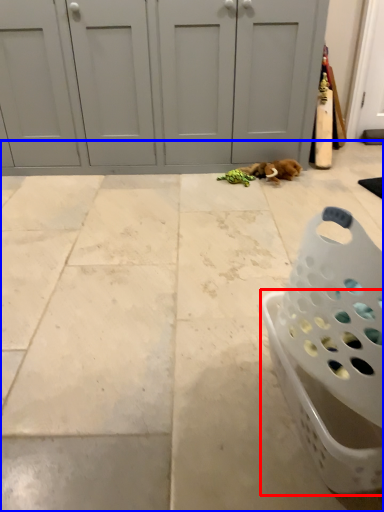
Question: Which of the following is the closest to the observer, basket (highlighted by a red box) or concrete (highlighted by a blue box)?

Choices:
 (A) basket
 (B) concrete

Answer: (A)